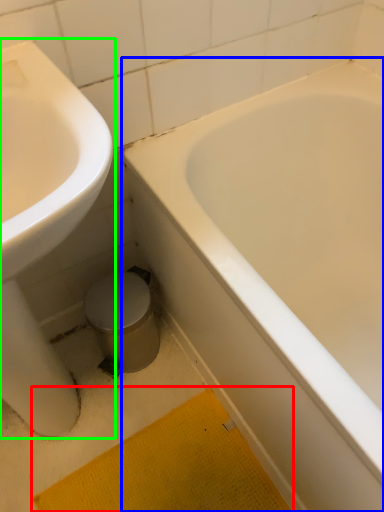
Question: Estimate the real-world distances between objects in this image. Which object is farther from bath mat (highlighted by a red box), bathtub (highlighted by a blue box) or sink (highlighted by a green box)?

Choices:
 (A) bathtub
 (B) sink

Answer: (A)